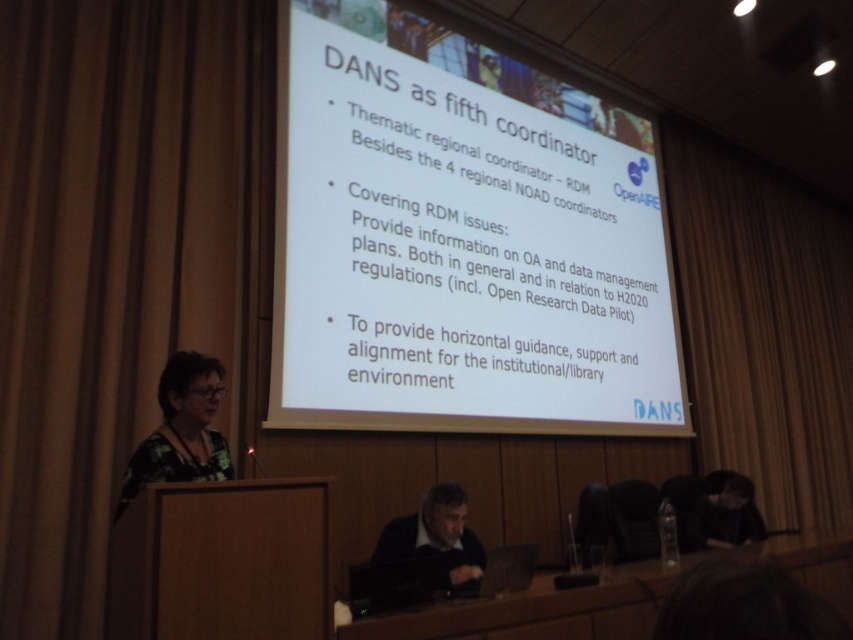
Between dark gray sweater at center and black fabric at lower right, which one is positioned higher?

Positioned higher is dark gray sweater at center.

Between dark gray sweater at center and black fabric at lower right, which one has less height?

black fabric at lower right

Is point (473, 536) closer to camera compared to point (733, 477)?

Yes.

Find the location of a particular element. The width and height of the screenshot is (853, 640). dark gray sweater at center is located at coordinates (428, 541).

Who is positioned more to the right, white paper at center or wooden table at lower center?

From the viewer's perspective, wooden table at lower center appears more on the right side.

How much distance is there between white paper at center and wooden table at lower center?

The distance of white paper at center from wooden table at lower center is 2.13 meters.

Who is more forward, [376,403] or [610,625]?

Point [610,625] is in front.

Find the location of a particular element. white paper at center is located at coordinates click(460, 240).

Is white paper at center to the right of black fabric at lower right from the viewer's perspective?

In fact, white paper at center is to the left of black fabric at lower right.

Which is behind, point (345, 202) or point (759, 531)?

The point (759, 531) is more distant.

Locate an element on the screen. white paper at center is located at coordinates (460, 240).